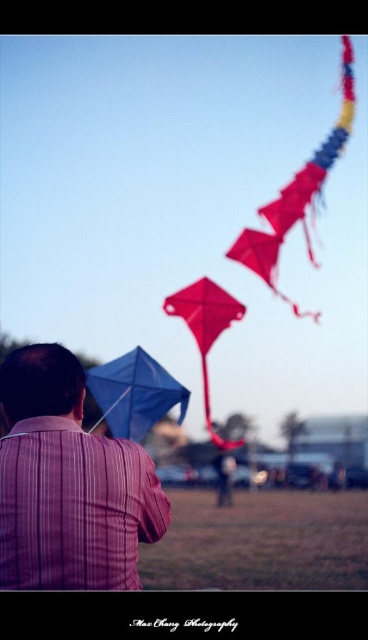
You are standing at the point marked as point [348,125] and want to throw a ball to a friend who is standing at the other point. If the ball can travel 15 meters, will it reach them?

The distance between the two points is 15.39 meters. Since the ball can only travel 15 meters, it will not reach your friend.

You are standing in the scene and want to take a photo of the blue fabric kite at center and the red matte kite at center. Which kite should you focus on first to ensure both are in focus?

You should focus on the blue fabric kite at center first because it is closer to you than the red matte kite at center, so adjusting focus from near to far will help both be in focus.